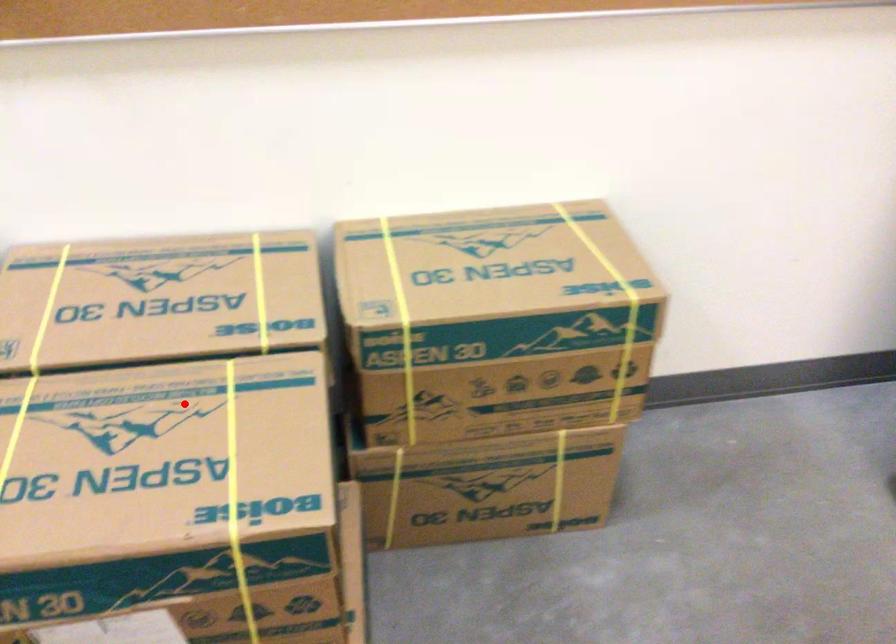
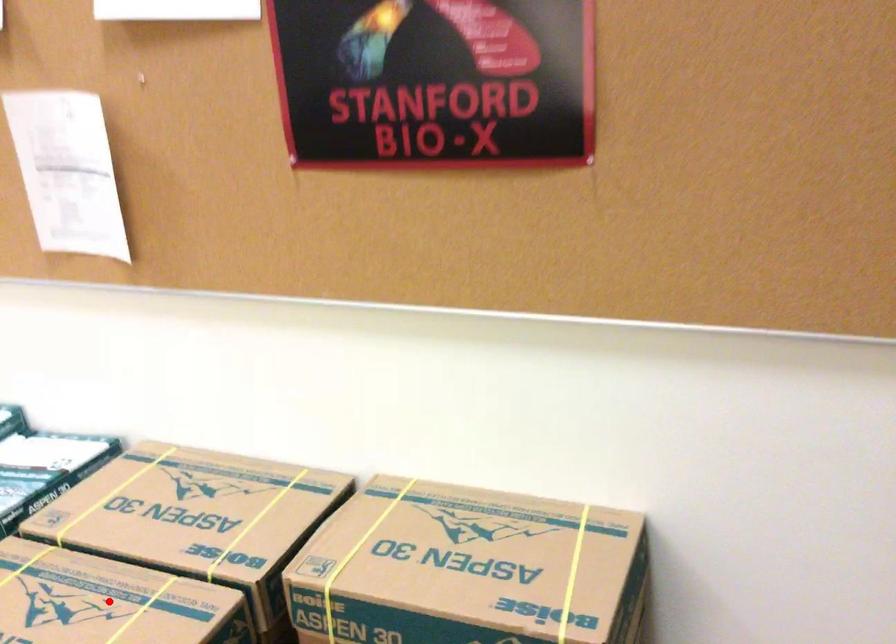
I am providing you with two images of the same scene from different viewpoints. A red point is marked on the first image and another point is marked on the second image. Are the points marked in image1 and image2 representing the same 3D position?

Yes